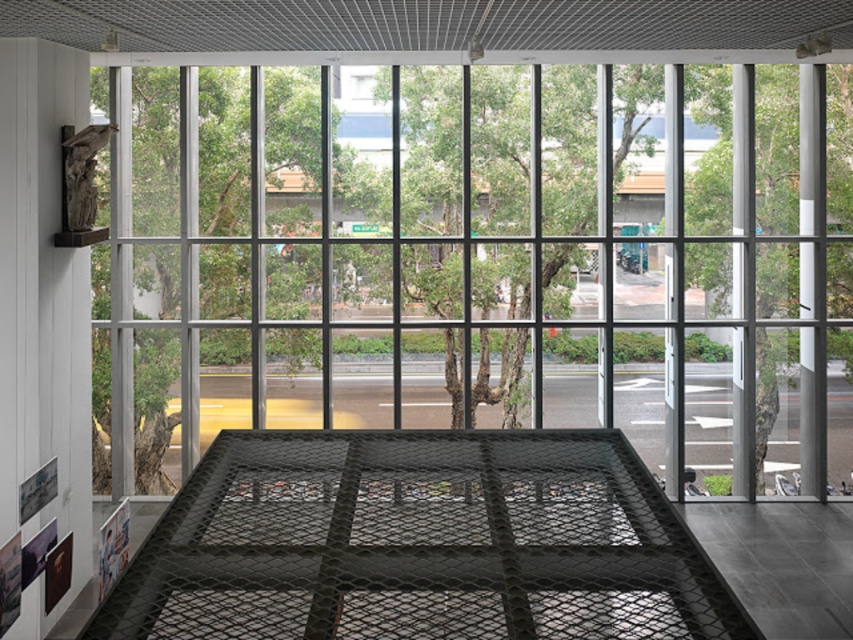
Looking at this image, is black mesh cage at center further to the viewer compared to white glossy pillar at right?

No, it is not.

Who is more forward, (370, 442) or (813, 406)?

Positioned in front is point (370, 442).

Identify the location of black mesh cage at center. click(x=421, y=544).

What do you see at coordinates (469, 252) in the screenshot? This screenshot has height=640, width=853. I see `transparent glass door at center` at bounding box center [469, 252].

Identify the location of transparent glass door at center. The width and height of the screenshot is (853, 640). (469, 252).

Who is positioned more to the right, transparent glass door at center or white glossy pillar at right?

white glossy pillar at right

Is transparent glass door at center above white glossy pillar at right?

Yes.

Measure the distance between point (520, 104) and camera.

Point (520, 104) is 16.60 meters away from camera.

At what (x,y) coordinates should I click in order to perform the action: click on transparent glass door at center. Please return your answer as a coordinate pair (x, y). Looking at the image, I should click on (469, 252).